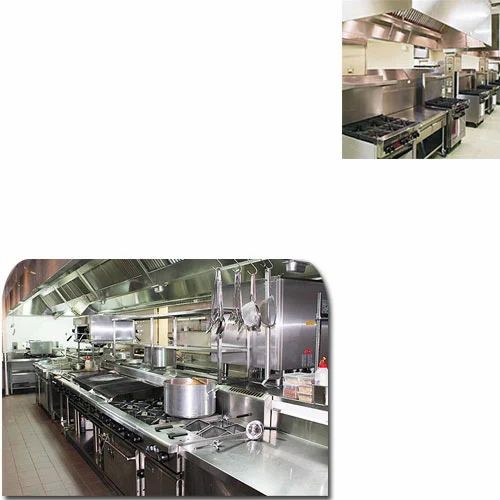
The image size is (500, 500). What are the coordinates of `kitchens` in the screenshot? It's located at (377, 111), (270, 391).